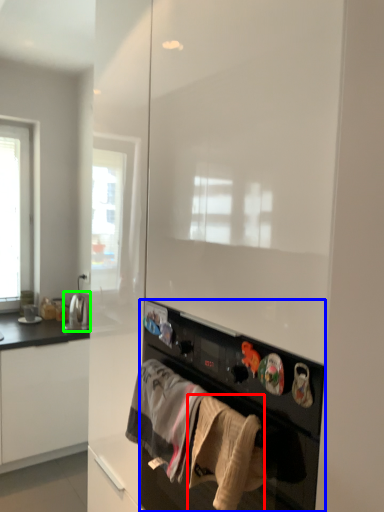
Question: Which object is positioned farthest from clothing (highlighted by a red box)? Select from home appliance (highlighted by a blue box) and appliance (highlighted by a green box).

Choices:
 (A) home appliance
 (B) appliance

Answer: (B)